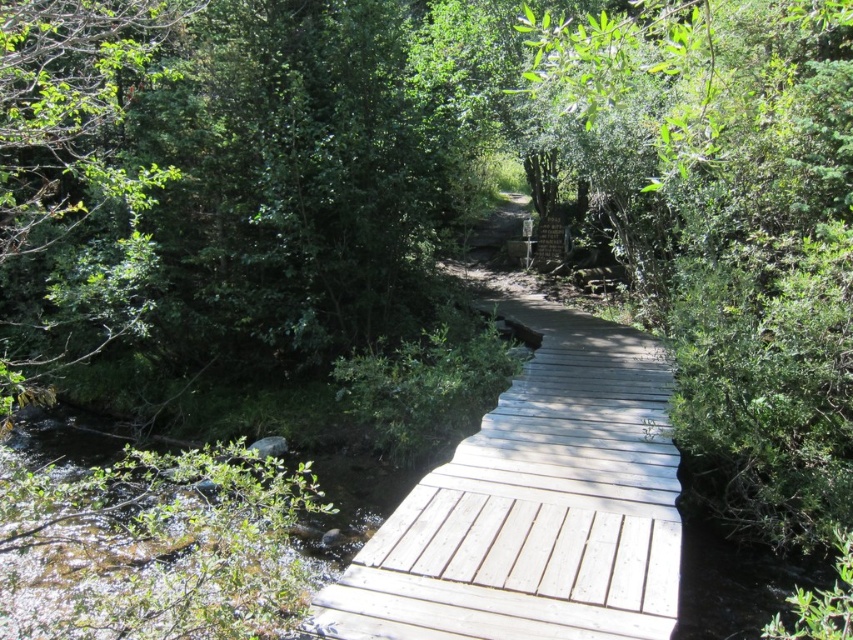
Question: Is light gray wooden bridge at center bigger than green leafy tree at left?

Choices:
 (A) no
 (B) yes

Answer: (B)

Question: Which of the following is the closest to the observer?

Choices:
 (A) light gray wooden bridge at center
 (B) green leafy tree at left

Answer: (B)

Question: Does light gray wooden bridge at center have a smaller size compared to green leafy tree at left?

Choices:
 (A) yes
 (B) no

Answer: (B)

Question: Is light gray wooden bridge at center below green leafy tree at left?

Choices:
 (A) no
 (B) yes

Answer: (B)

Question: Which point is closer to the camera?

Choices:
 (A) light gray wooden bridge at center
 (B) green leafy tree at left

Answer: (B)